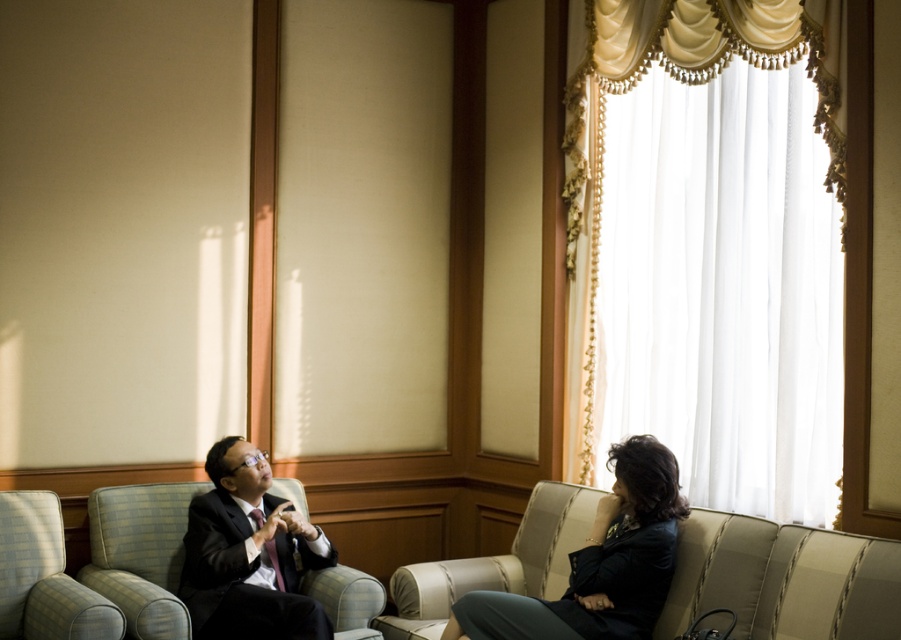
Can you confirm if black suit at left is thinner than matte black suit at left?

Indeed, black suit at left has a lesser width compared to matte black suit at left.

Is point (663, 536) in front of point (319, 625)?

No, (663, 536) is further to viewer.

The height and width of the screenshot is (640, 901). In order to click on black suit at left in this screenshot , I will do `click(244, 557)`.

From the picture: Is black suit at left above dark blue fabric jacket at lower right?

Yes, black suit at left is above dark blue fabric jacket at lower right.

Is black suit at left shorter than dark blue fabric jacket at lower right?

Yes.

Find the location of a particular element. black suit at left is located at coordinates (244, 557).

The width and height of the screenshot is (901, 640). Describe the element at coordinates (783, 579) in the screenshot. I see `beige leather couch at lower right` at that location.

Who is lower down, beige leather couch at lower right or black suit at left?

beige leather couch at lower right

Is point (714, 509) closer to viewer compared to point (289, 582)?

That is True.

The image size is (901, 640). Find the location of `beige leather couch at lower right`. beige leather couch at lower right is located at coordinates (783, 579).